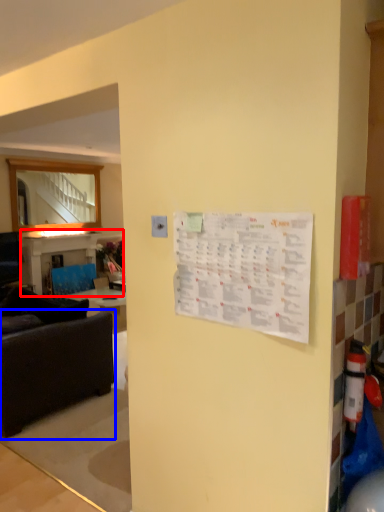
Question: Which object is closer to the camera taking this photo, table (highlighted by a red box) or studio couch (highlighted by a blue box)?

Choices:
 (A) table
 (B) studio couch

Answer: (B)